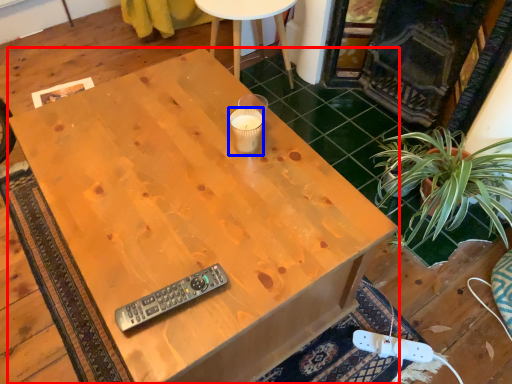
Question: Which point is further to the camera, desk (highlighted by a red box) or coffee cup (highlighted by a blue box)?

Choices:
 (A) desk
 (B) coffee cup

Answer: (B)